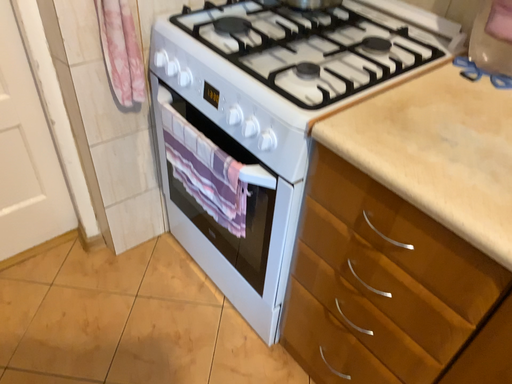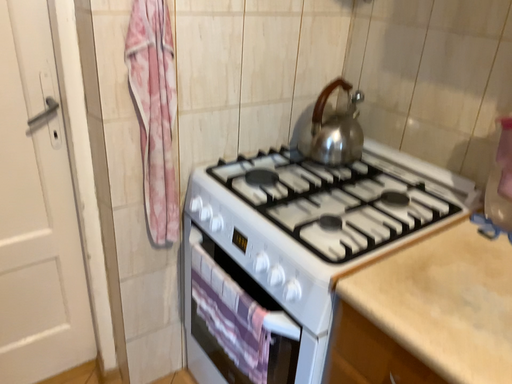
Question: Which way did the camera rotate in the video?

Choices:
 (A) rotated downward
 (B) rotated upward

Answer: (B)